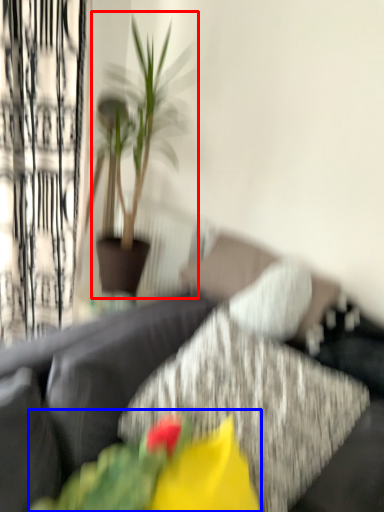
Question: Which object is further to the camera taking this photo, houseplant (highlighted by a red box) or floral arrangement (highlighted by a blue box)?

Choices:
 (A) houseplant
 (B) floral arrangement

Answer: (A)